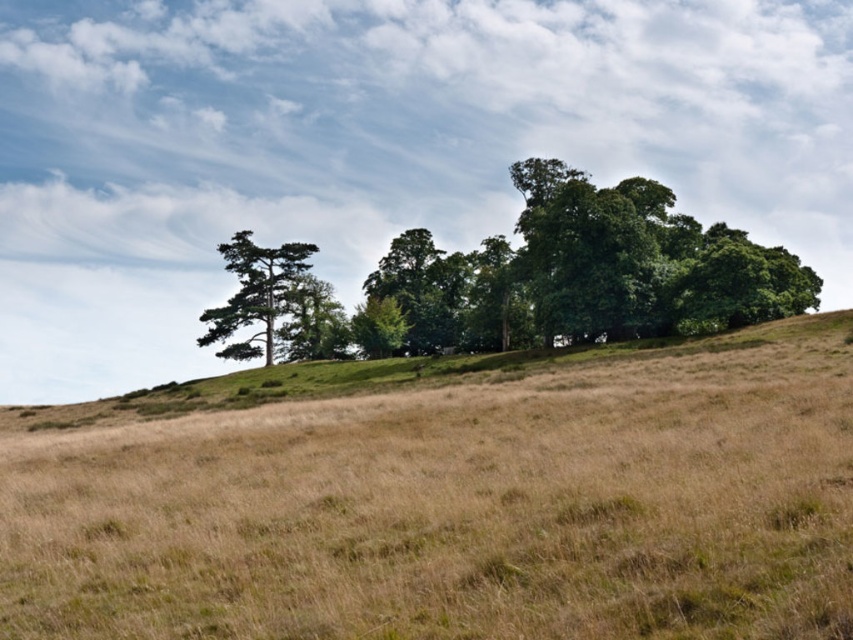
You are standing on the brown grassy hillside at center and want to walk to the green matte tree at left. Which direction should you head towards?

Since the brown grassy hillside at center is closer to the viewer than the green matte tree at left, you should head towards the left direction to reach the green matte tree at left.